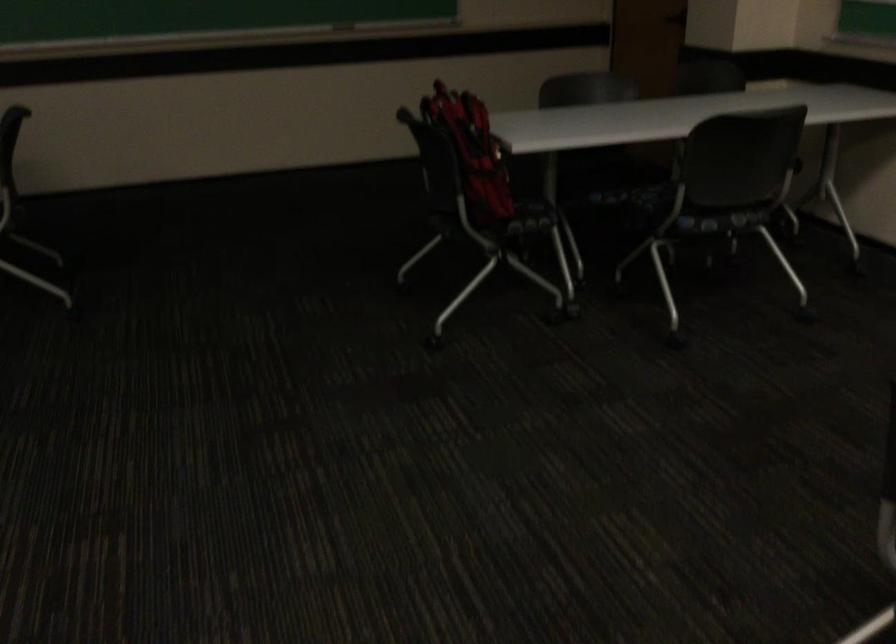
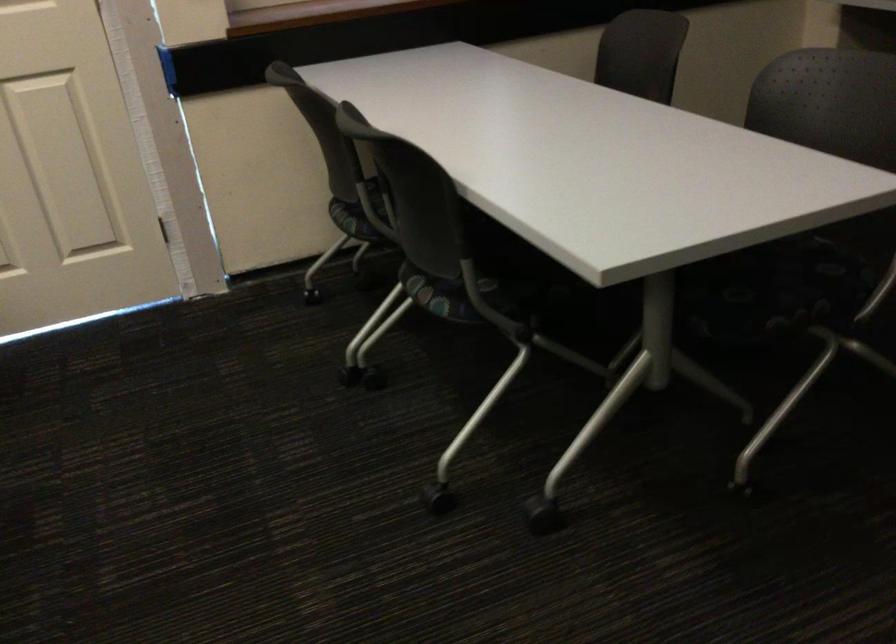
How did the camera likely rotate?

The camera rotated toward left-down.